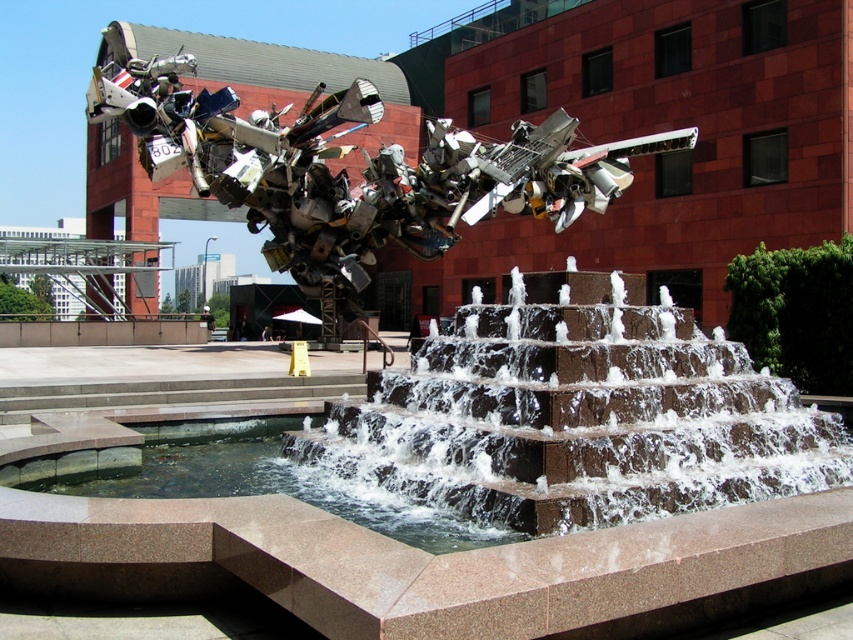
You are standing in front of the fountain and want to take a photo. There are two points of interest marked in the scene. The first is at coordinate point (692, 449) and the second at point (477, 532). Which point is closer to your camera position?

Point (692, 449) is further to the camera than point (477, 532), so the second point is closer to your camera position.

You are standing in the urban scene and want to know which object is higher between the brown stone fountain at center and the clear water at bottom center. Can you tell me?

The brown stone fountain at center is taller than clear water at bottom center.

You are a maintenance worker who needs to clean the brown stone fountain at center and the clear water at bottom center. You have a 5 meter long hose. Can you reach both locations from a single point without moving the hose? Explain your reasoning.

The brown stone fountain at center and clear water at bottom center are 4.91 meters apart. Since the hose is 5 meters long, which is slightly longer than the distance between them, you can position the hose so that it reaches both locations from a single point without needing to move it.